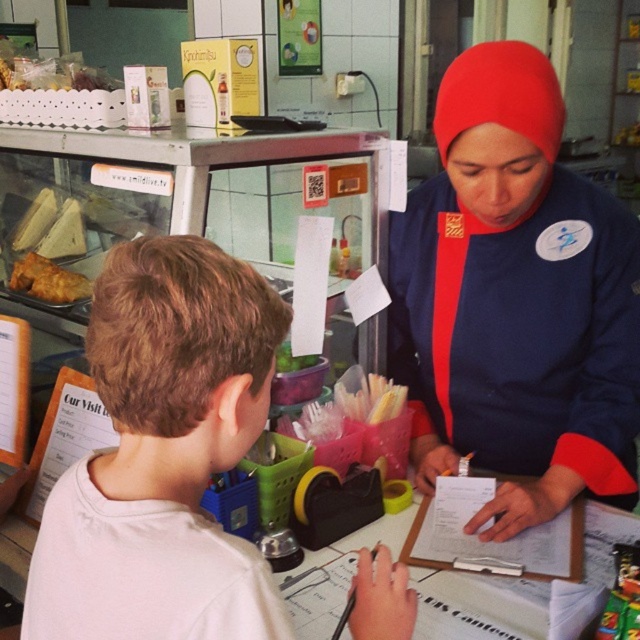
Between point (470, 106) and point (145, 396), which one is positioned in front?

Point (145, 396)

Does blue fabric hijab at center have a greater width compared to white matte shirt at center?

Yes, blue fabric hijab at center is wider than white matte shirt at center.

Find the location of `blue fabric hijab at center`. blue fabric hijab at center is located at coordinates (515, 300).

Find the location of a particular element. The image size is (640, 640). blue fabric hijab at center is located at coordinates (515, 300).

Where is `blue fabric hijab at center`? This screenshot has height=640, width=640. blue fabric hijab at center is located at coordinates (515, 300).

Is point (428, 248) farther from camera compared to point (81, 294)?

That is False.

You are a GUI agent. You are given a task and a screenshot of the screen. Output one action in this format:
    pyautogui.click(x=<x>, y=<y>)
    Task: Click on the blue fabric hijab at center
    The image size is (640, 640).
    Given the screenshot: What is the action you would take?
    pyautogui.click(x=515, y=300)

Between point (157, 342) and point (35, 262), which one is positioned in front?

Point (157, 342)

Does point (156, 572) lie behind point (44, 264)?

That is False.

The width and height of the screenshot is (640, 640). In order to click on white matte shirt at center in this screenshot , I will do `click(163, 456)`.